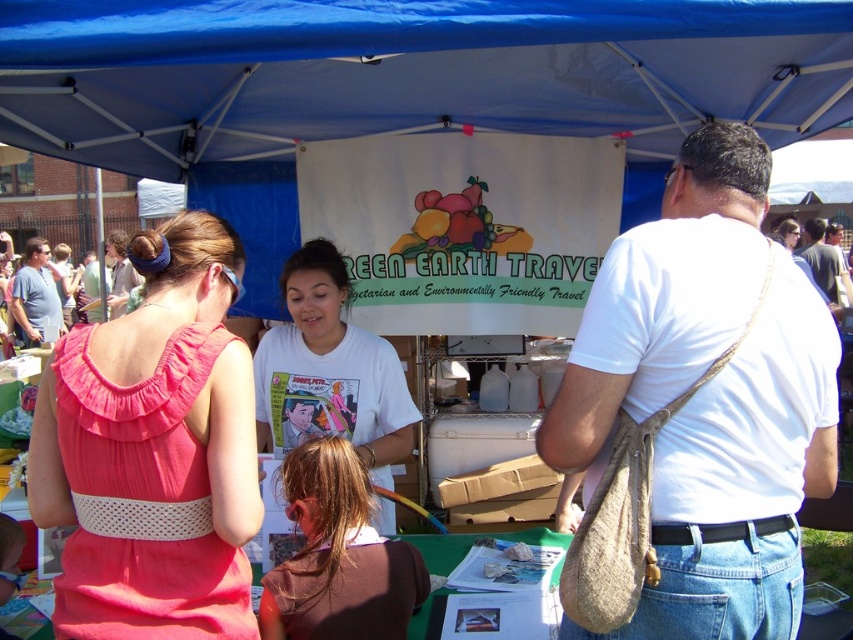
You are a visitor at the Green Earth Travel event and want to move from the pink fabric dress at upper left to the matte blue shirt at left. Can you walk directly between them without needing to detour around any obstacles?

The distance between the pink fabric dress at upper left and the matte blue shirt at left is 7.43 meters, so yes, you can walk directly between them without needing to detour around any obstacles since there is sufficient space.

Consider the image. You are organizing a clothing donation drive and need to determine which item takes up more space in the donation box. Which of the following items would require more space in the box? The white cotton shirt at center or the pink fabric dress at upper left?

The white cotton shirt at center is bigger than the pink fabric dress at upper left, so it would require more space in the donation box.